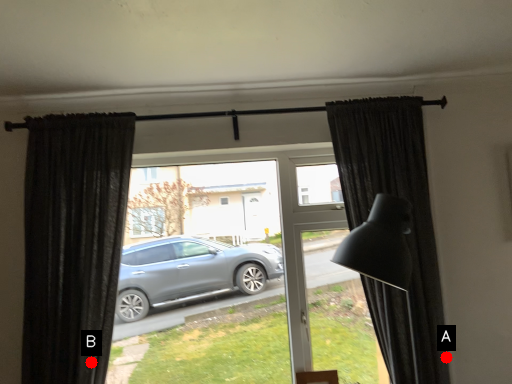
Question: Two points are circled on the image, labeled by A and B beside each circle. Which of the following is the closest to the observer?

Choices:
 (A) A is closer
 (B) B is closer

Answer: (B)